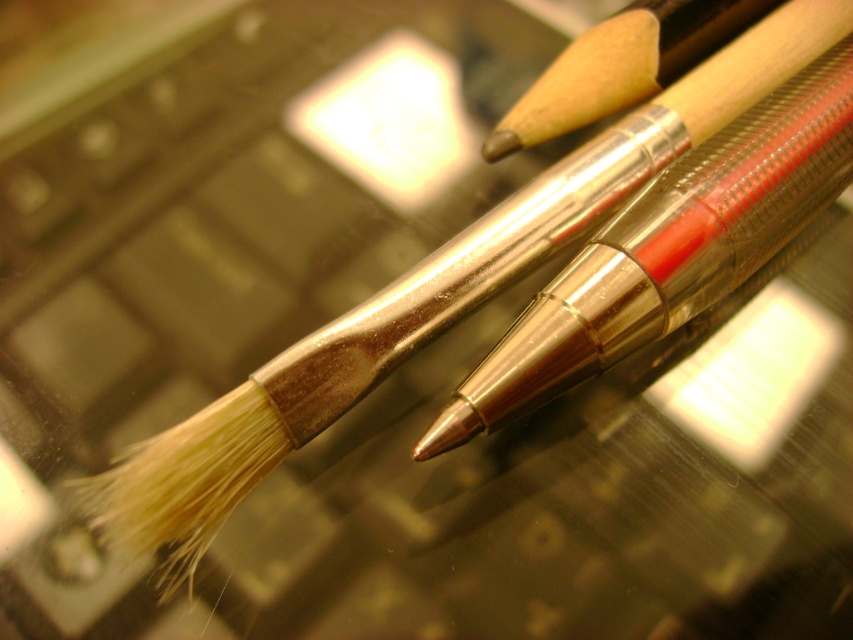
Question: Which point is closer to the camera?

Choices:
 (A) matte metallic paint brush at center
 (B) wooden paint brush at upper right

Answer: (A)

Question: Can you confirm if matte metallic paint brush at center is positioned above wooden paint brush at upper right?

Choices:
 (A) yes
 (B) no

Answer: (B)

Question: Is matte metallic paint brush at center above wooden paint brush at upper right?

Choices:
 (A) no
 (B) yes

Answer: (A)

Question: Which of the following is the farthest from the observer?

Choices:
 (A) (611, 84)
 (B) (685, 246)

Answer: (A)

Question: Can you confirm if matte metallic paint brush at center is positioned to the right of wooden paint brush at upper right?

Choices:
 (A) no
 (B) yes

Answer: (B)